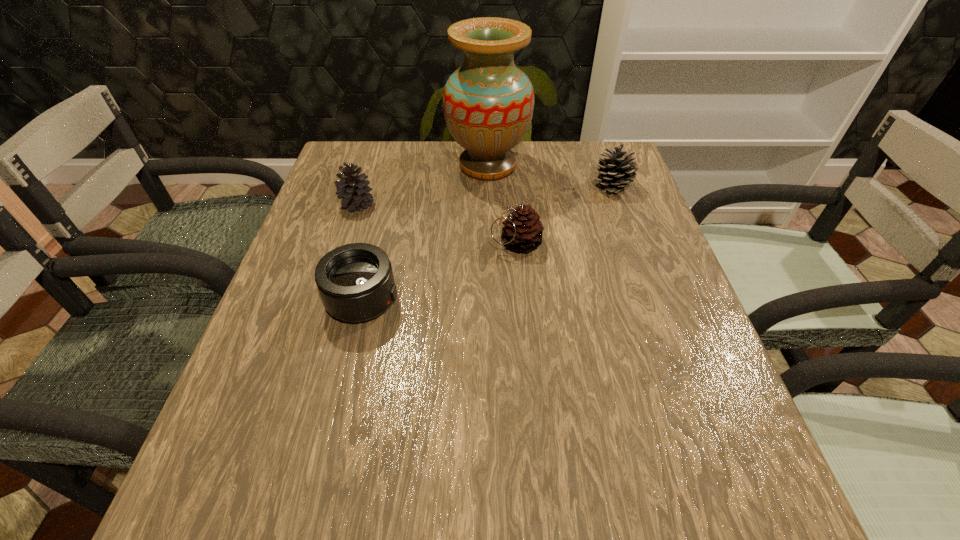
This screenshot has height=540, width=960. In the image, there is a desktop. In order to click on vacant space at the left edge in this screenshot , I will do `click(226, 467)`.

The width and height of the screenshot is (960, 540). I want to click on vacant area at the right edge of the desktop, so click(x=699, y=376).

The image size is (960, 540). In the image, there is a desktop. In order to click on free space at the far left corner in this screenshot , I will do `click(369, 170)`.

What are the coordinates of `vacant space at the near right corner of the desktop` in the screenshot? It's located at (680, 538).

The width and height of the screenshot is (960, 540). In order to click on free space between the leftmost pinecone and the rightmost object in this screenshot , I will do `click(485, 195)`.

Where is `free spot between the nearest object and the fourth farthest object`? This screenshot has height=540, width=960. free spot between the nearest object and the fourth farthest object is located at coordinates (440, 272).

Locate an element on the screen. unoccupied position between the rightmost pinecone and the leftmost pinecone is located at coordinates (485, 195).

Where is `empty space between the leftmost pinecone and the rightmost pinecone`? This screenshot has width=960, height=540. empty space between the leftmost pinecone and the rightmost pinecone is located at coordinates (485, 195).

Where is `unoccupied area between the nearest object and the rightmost pinecone`? The height and width of the screenshot is (540, 960). unoccupied area between the nearest object and the rightmost pinecone is located at coordinates (488, 243).

Find the location of `free space between the rightmost pinecone and the telephoto lens`. free space between the rightmost pinecone and the telephoto lens is located at coordinates (488, 243).